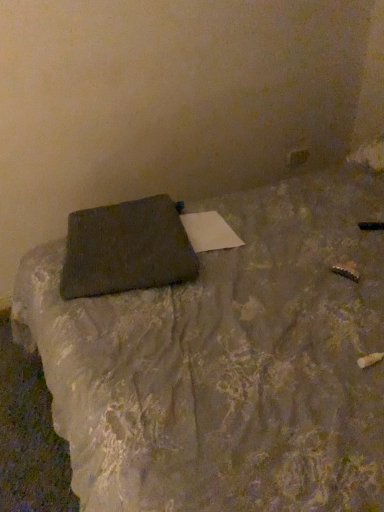
Question: From a real-world perspective, is matte black folder at center under brown textured pillow at center?

Choices:
 (A) no
 (B) yes

Answer: (A)

Question: Does matte black folder at center have a larger size compared to brown textured pillow at center?

Choices:
 (A) no
 (B) yes

Answer: (B)

Question: Is there a large distance between matte black folder at center and brown textured pillow at center?

Choices:
 (A) yes
 (B) no

Answer: (B)

Question: Is matte black folder at center oriented towards brown textured pillow at center?

Choices:
 (A) no
 (B) yes

Answer: (B)

Question: Are matte black folder at center and brown textured pillow at center beside each other?

Choices:
 (A) yes
 (B) no

Answer: (B)

Question: Does matte black folder at center have a lesser height compared to brown textured pillow at center?

Choices:
 (A) yes
 (B) no

Answer: (B)

Question: Considering the relative sizes of brown textured pillow at center and matte black folder at center in the image provided, is brown textured pillow at center shorter than matte black folder at center?

Choices:
 (A) no
 (B) yes

Answer: (B)

Question: Is brown textured pillow at center positioned with its back to matte black folder at center?

Choices:
 (A) yes
 (B) no

Answer: (A)

Question: Is brown textured pillow at center completely or partially outside of matte black folder at center?

Choices:
 (A) yes
 (B) no

Answer: (B)

Question: From the image's perspective, is brown textured pillow at center below matte black folder at center?

Choices:
 (A) no
 (B) yes

Answer: (A)

Question: Could you tell me if brown textured pillow at center is turned towards matte black folder at center?

Choices:
 (A) yes
 (B) no

Answer: (A)

Question: Considering the relative sizes of brown textured pillow at center and matte black folder at center in the image provided, is brown textured pillow at center smaller than matte black folder at center?

Choices:
 (A) yes
 (B) no

Answer: (A)

Question: Visually, is matte black folder at center positioned to the left or to the right of brown textured pillow at center?

Choices:
 (A) left
 (B) right

Answer: (B)